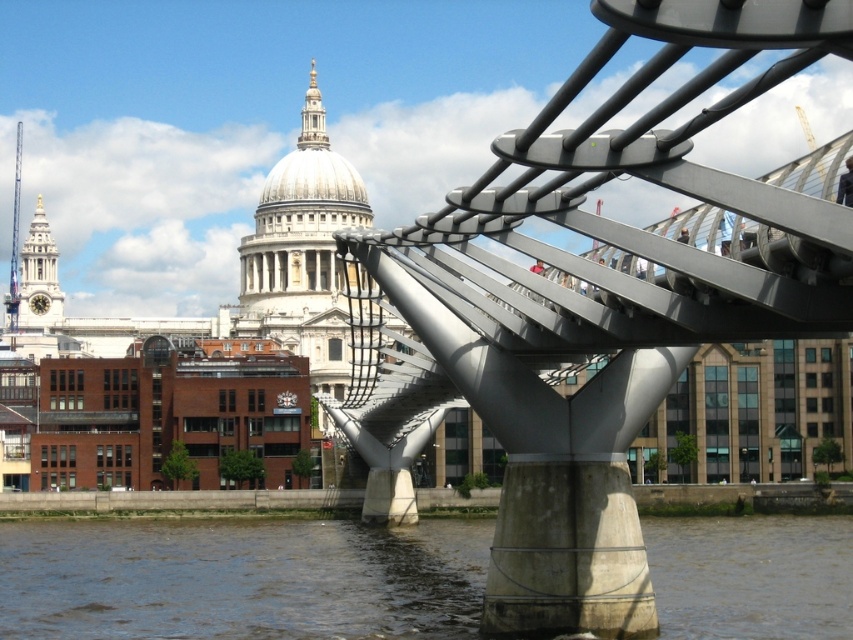
You are a tourist standing on the Millennium Bridge in London. You notice the metallic silver suspension bridge at center and the brown water at lower center. Which object is higher in elevation?

The metallic silver suspension bridge at center is taller than the brown water at lower center, so the metallic silver suspension bridge at center is higher in elevation.

You are standing on the Millennium Bridge in London, looking towards St. Pauls Cathedral. You notice two points marked on the bridge. The first is at coordinates point [543,250] and the second at point [149,596]. Which of these points is closer to you as you stand on the bridge facing the cathedral?

Point [543,250] is closer to the viewer than point [149,596].

From the picture: You are a tourist standing on the Millennium Bridge and want to take a photo of the brown water at lower center and the metallic silver suspension bridge at center. Which object appears wider in the photo?

The brown water at lower center appears wider in the photo because the metallic silver suspension bridge at center has a lesser width compared to brown water at lower center.